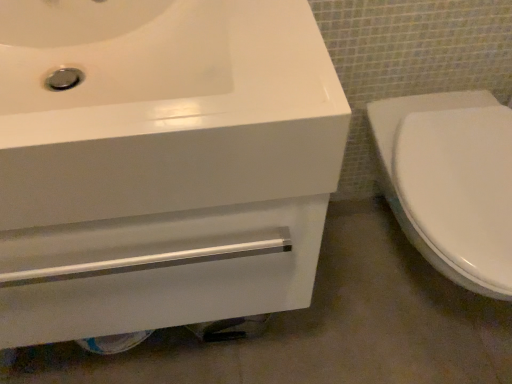
Find the location of a particular element. The image size is (512, 384). free point above white glossy drawer at lower left (from a real-world perspective) is located at coordinates (323, 323).